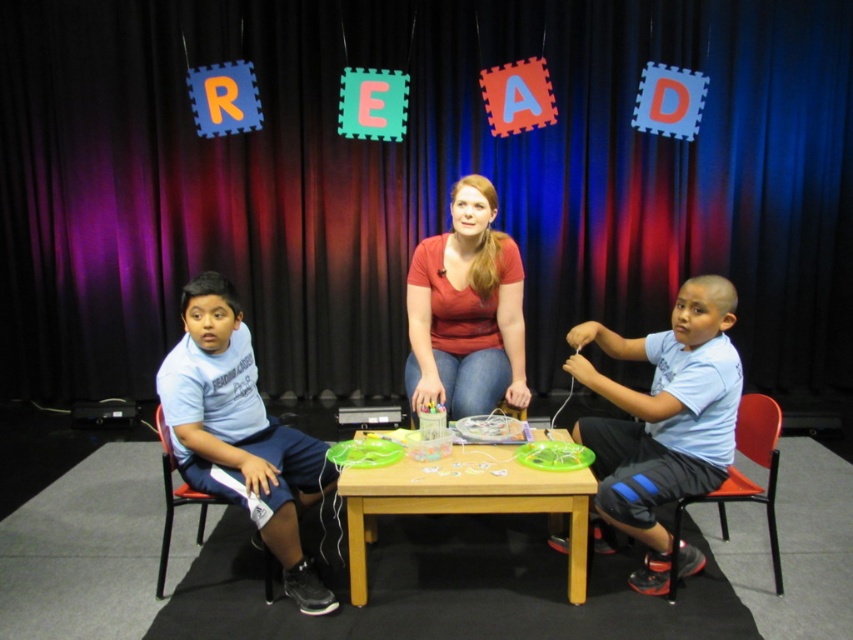
Can you confirm if light blue t-shirt at left is smaller than wooden table at center?

No, light blue t-shirt at left is not smaller than wooden table at center.

The width and height of the screenshot is (853, 640). What do you see at coordinates (241, 433) in the screenshot? I see `light blue t-shirt at left` at bounding box center [241, 433].

Identify the location of light blue t-shirt at left. (241, 433).

The image size is (853, 640). Find the location of `light blue t-shirt at left`. light blue t-shirt at left is located at coordinates (241, 433).

At what (x,y) coordinates should I click in order to perform the action: click on matte black curtain at center. Please return your answer as a coordinate pair (x, y). The width and height of the screenshot is (853, 640). Looking at the image, I should click on (415, 180).

The width and height of the screenshot is (853, 640). Describe the element at coordinates (415, 180) in the screenshot. I see `matte black curtain at center` at that location.

The image size is (853, 640). I want to click on matte black curtain at center, so click(x=415, y=180).

Where is `matte black curtain at center`? The width and height of the screenshot is (853, 640). matte black curtain at center is located at coordinates (415, 180).

Can you confirm if orange plastic chair at right is positioned to the left of black plastic chair at left?

No, orange plastic chair at right is not to the left of black plastic chair at left.

Who is higher up, orange plastic chair at right or black plastic chair at left?

black plastic chair at left is above.

Locate an element on the screen. This screenshot has height=640, width=853. orange plastic chair at right is located at coordinates (741, 480).